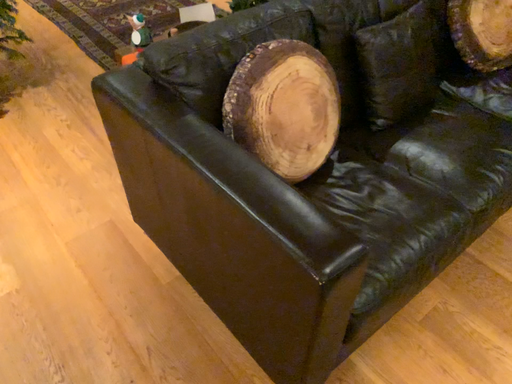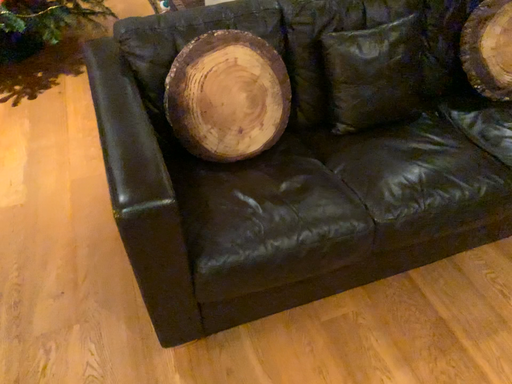
Question: Which way did the camera rotate in the video?

Choices:
 (A) rotated left
 (B) rotated right

Answer: (A)